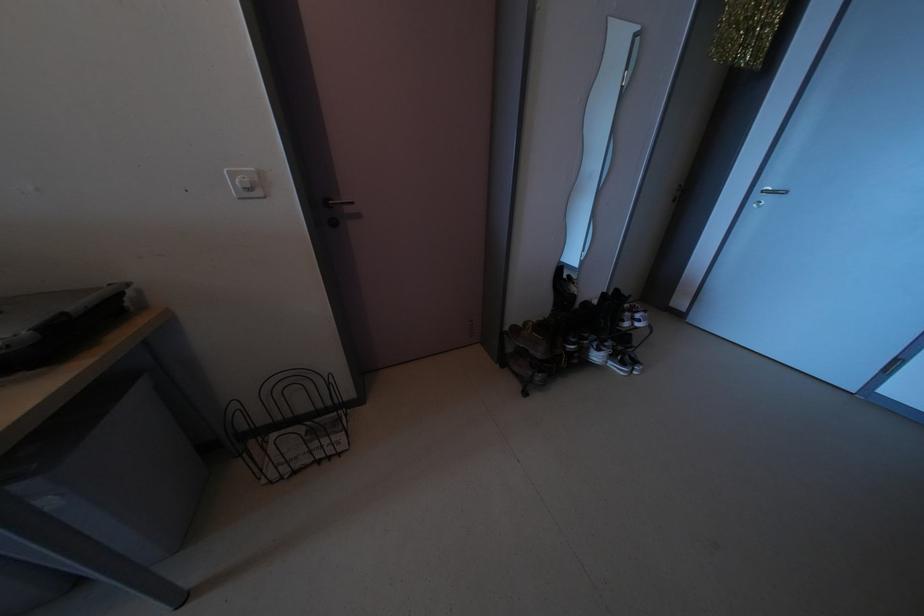
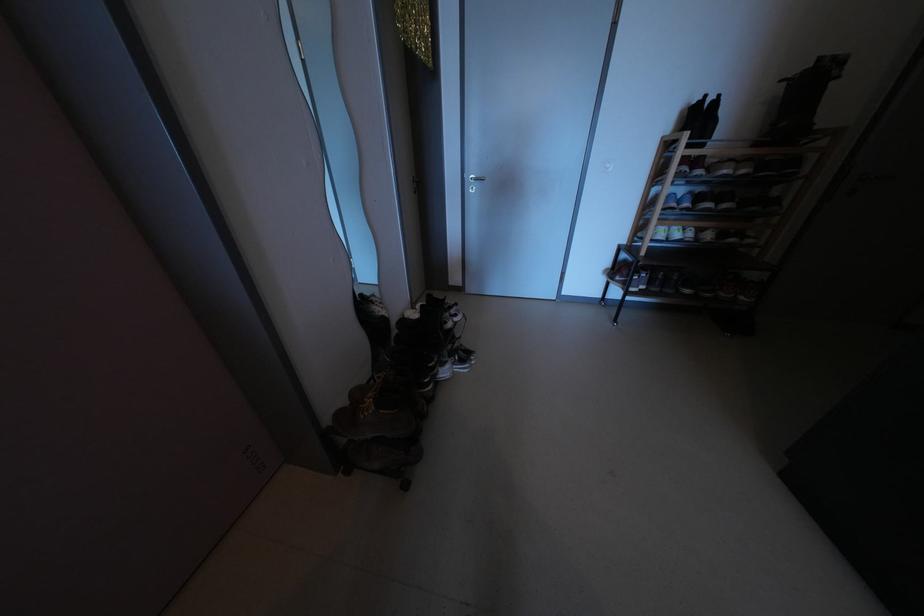
Question: Based on the continuous images, in which direction is the camera rotating? Reply with the corresponding letter.

Choices:
 (A) Left
 (B) Right
 (C) Up
 (D) Down

Answer: (B)